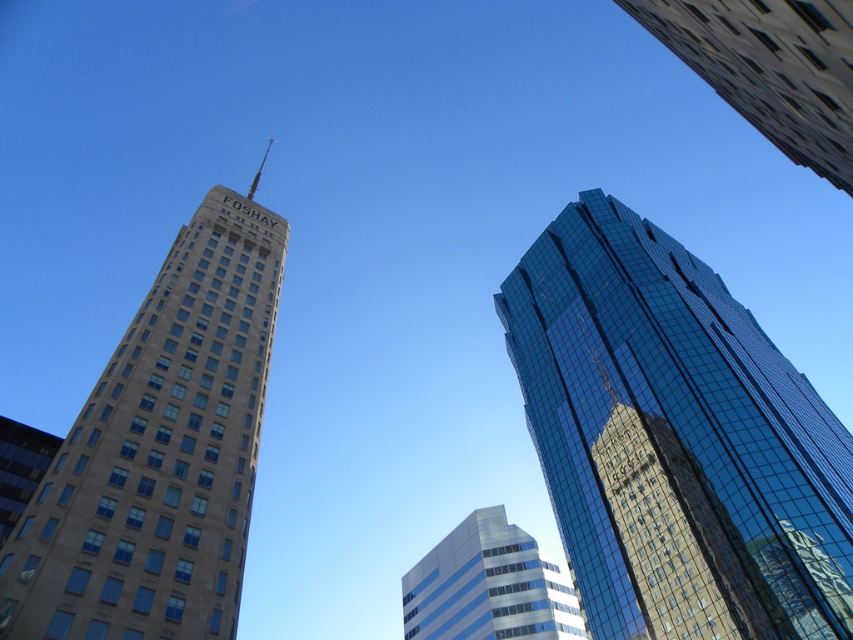
Is shiny glass skyscraper at upper right closer to the viewer compared to silver glass building at center?

Yes, it is in front of silver glass building at center.

Who is more distant from viewer, (804, 534) or (561, 579)?

Point (561, 579)

Where is `shiny glass skyscraper at upper right`? This screenshot has width=853, height=640. shiny glass skyscraper at upper right is located at coordinates click(675, 440).

Who is more distant from viewer, (569,371) or (200,618)?

Point (569,371)

Between shiny glass skyscraper at upper right and beige stone tower at left, which one has less height?

Standing shorter between the two is beige stone tower at left.

Locate an element on the screen. The height and width of the screenshot is (640, 853). shiny glass skyscraper at upper right is located at coordinates (675, 440).

Identify the location of shiny glass skyscraper at upper right. The height and width of the screenshot is (640, 853). (675, 440).

Who is positioned more to the left, shiny glass skyscraper at upper right or glassy reflective skyscraper at upper right?

Positioned to the left is glassy reflective skyscraper at upper right.

Consider the image. Which of these two, shiny glass skyscraper at upper right or glassy reflective skyscraper at upper right, stands taller?

With more height is shiny glass skyscraper at upper right.

Locate an element on the screen. The image size is (853, 640). shiny glass skyscraper at upper right is located at coordinates (675, 440).